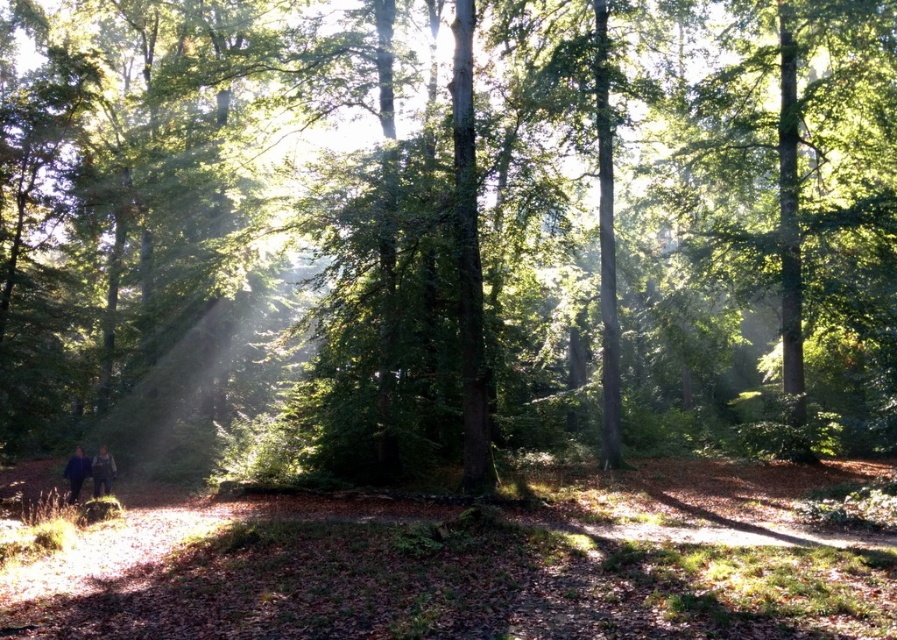
You are standing in the forest and want to pick up the dark blue fabric at lower left. You are currently holding the dark blue jacket at lower left. Can you reach the fabric without letting go of the jacket?

The dark blue fabric at lower left is 31.53 inches away from the dark blue jacket at lower left. Since the distance is more than an average person can reach while holding the jacket, you would need to move closer or place the jacket down first.

You are standing at the camera position in the forest scene. There is a dark blue fabric at lower left. Can you reach it without moving more than 20 meters?

The dark blue fabric at lower left and camera are 18.89 meters apart, so yes, you can reach it without moving more than 20 meters.

You are a hiker who wants to use the dark blue fabric at lower left and the dark blue jacket at lower left to set up a makeshift shelter. Which item would be more effective as a rain cover?

The dark blue jacket at lower left is thicker than the dark blue fabric at lower left, making it more effective as a rain cover.